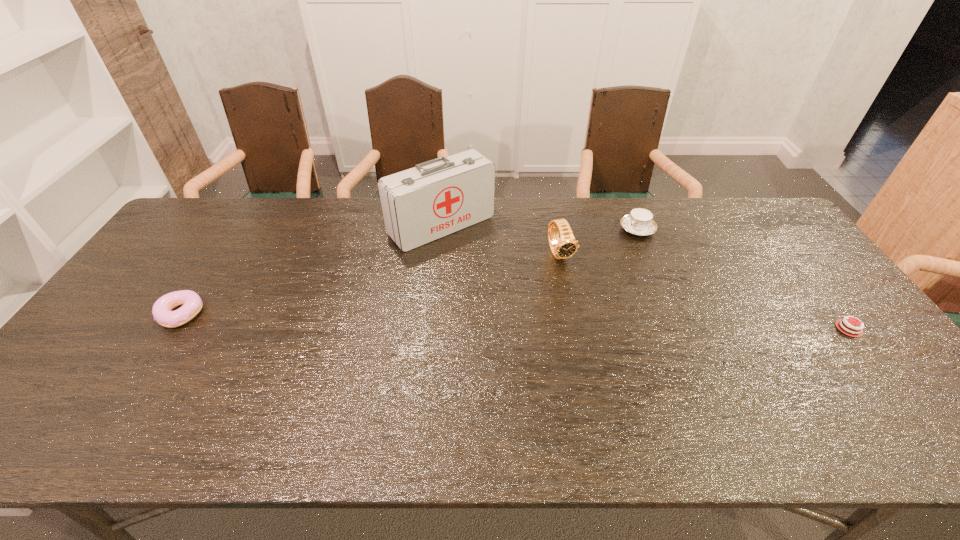
Where is `the second shortest object`? the second shortest object is located at coordinates (191, 301).

Where is `the leftmost object`? Image resolution: width=960 pixels, height=540 pixels. the leftmost object is located at coordinates (191, 301).

At what (x,y) coordinates should I click in order to perform the action: click on chocolate cake. Please return your answer as a coordinate pair (x, y). Image resolution: width=960 pixels, height=540 pixels. Looking at the image, I should click on (847, 328).

The image size is (960, 540). In order to click on the shortest object in this screenshot , I will do `click(847, 328)`.

Find the location of a particular element. The image size is (960, 540). the first-aid kit is located at coordinates (435, 198).

The width and height of the screenshot is (960, 540). Identify the location of the tallest object. (435, 198).

Image resolution: width=960 pixels, height=540 pixels. I want to click on the fourth shortest object, so click(x=567, y=246).

The width and height of the screenshot is (960, 540). In order to click on watch in this screenshot , I will do `click(567, 246)`.

This screenshot has width=960, height=540. I want to click on teacup, so click(639, 222).

Image resolution: width=960 pixels, height=540 pixels. What are the coordinates of `the second object from right to left` in the screenshot? It's located at (639, 222).